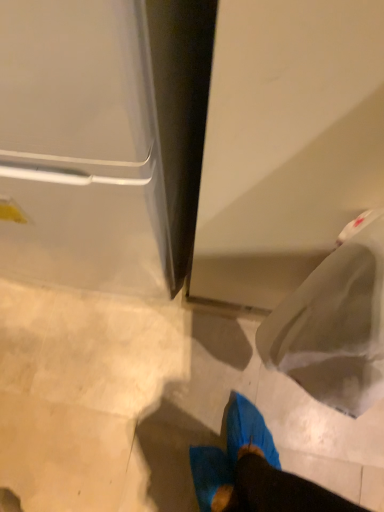
What do you see at coordinates (81, 148) in the screenshot?
I see `white glossy refrigerator at upper left` at bounding box center [81, 148].

This screenshot has width=384, height=512. I want to click on white glossy refrigerator at upper left, so click(x=81, y=148).

You are a GUI agent. You are given a task and a screenshot of the screen. Output one action in this format:
    pyautogui.click(x=<x>, y=<y>)
    Task: Click on the white glossy refrigerator at upper left
    The image size is (384, 512).
    Given the screenshot: What is the action you would take?
    pyautogui.click(x=81, y=148)